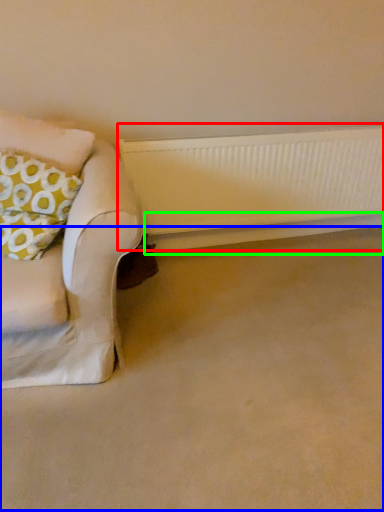
Question: Which object is positioned farthest from radiator (highlighted by a red box)? Select from plain (highlighted by a blue box) and window sill (highlighted by a green box).

Choices:
 (A) plain
 (B) window sill

Answer: (A)